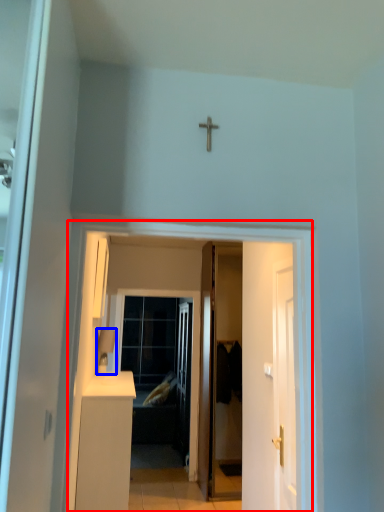
Question: Which object is further to the camera taking this photo, corridor (highlighted by a red box) or lamp (highlighted by a blue box)?

Choices:
 (A) corridor
 (B) lamp

Answer: (B)